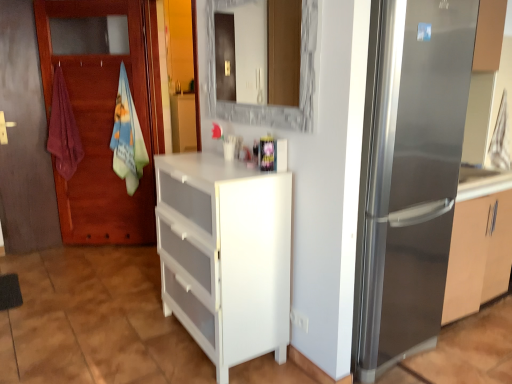
This screenshot has width=512, height=384. Identify the location of blank space to the left of white plastic chest of drawers at center. (128, 339).